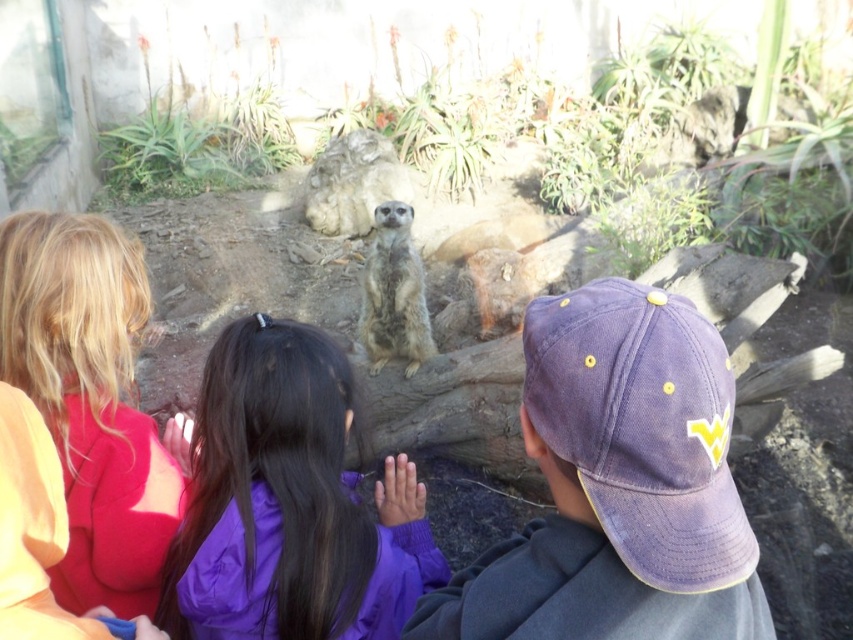
Question: Can you confirm if purple fabric at center is wider than purple cotton baseball cap at center?

Choices:
 (A) yes
 (B) no

Answer: (A)

Question: Which of these objects is positioned farthest from the light brown fur meerkat at center?

Choices:
 (A) blonde hair at left
 (B) purple cotton baseball cap at center
 (C) purple fabric at center

Answer: (B)

Question: Does purple fabric at center have a larger size compared to purple cotton baseball cap at center?

Choices:
 (A) yes
 (B) no

Answer: (A)

Question: Is purple cotton baseball cap at center to the left of light brown fur meerkat at center from the viewer's perspective?

Choices:
 (A) no
 (B) yes

Answer: (A)

Question: Among these points, which one is farthest from the camera?

Choices:
 (A) (274, 346)
 (B) (154, 611)
 (C) (381, 224)
 (D) (682, 524)

Answer: (C)

Question: Which of the following is the farthest from the observer?

Choices:
 (A) purple fabric at center
 (B) blonde hair at left
 (C) purple cotton baseball cap at center

Answer: (B)